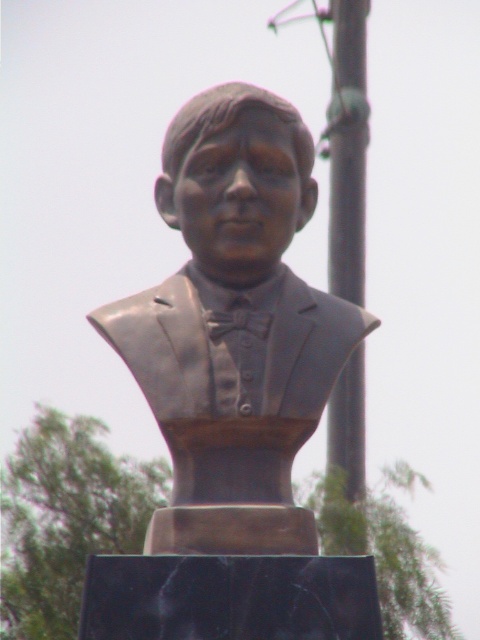
How far apart are bronze statue at center and smooth metallic pole at center?

They are 56.90 meters apart.

Is point (141, 378) less distant than point (334, 400)?

Yes, point (141, 378) is closer to viewer.

The image size is (480, 640). Find the location of `bronze statue at center`. bronze statue at center is located at coordinates (235, 326).